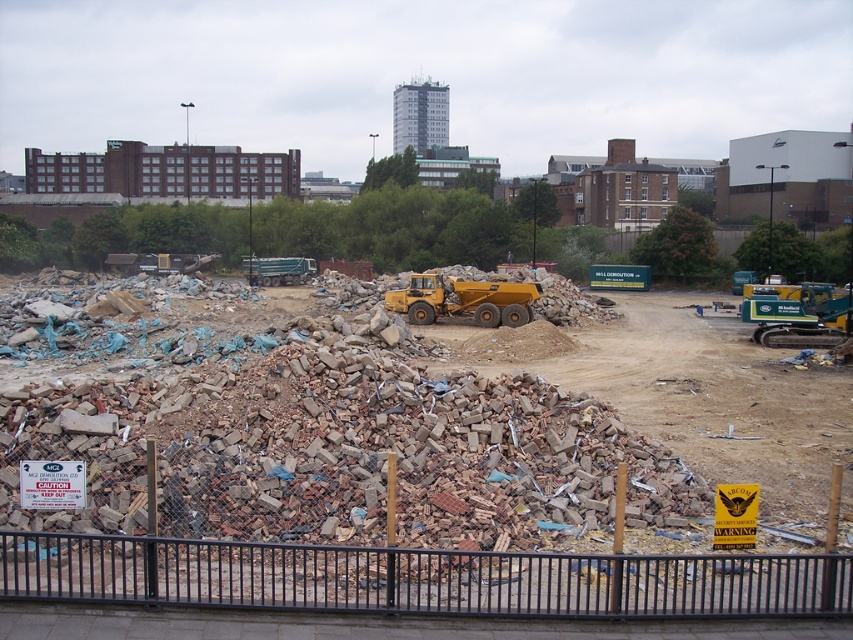
Between black metal fence at lower center and yellow rubber dump truck at center, which one is positioned lower?

black metal fence at lower center is lower down.

Which is in front, point (698, 579) or point (485, 321)?

Positioned in front is point (698, 579).

Find the location of `black metal fence at lower center`. black metal fence at lower center is located at coordinates 418,579.